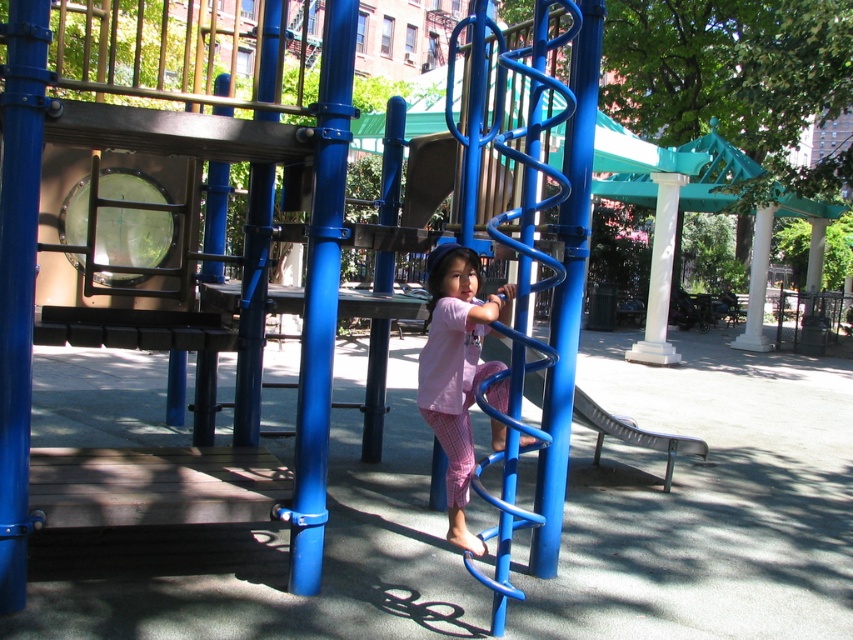
You are a parent watching your child play in the playground. You notice the pink cotton pants at center and the metallic blue slide at center. Which object is located higher from the ground?

The pink cotton pants at center is positioned over the metallic blue slide at center, so it is higher from the ground.

You are a parent watching your child play in the playground. You see the pink cotton pants at center and the metallic blue slide at center. Which object is located to the left of the other?

The pink cotton pants at center is positioned on the left side of metallic blue slide at center.

You are a parent supervising children at the playground. You notice the pink cotton pants at center and the metallic blue slide at center. Which object is smaller in size?

The pink cotton pants at center is smaller in size compared to the metallic blue slide at center.